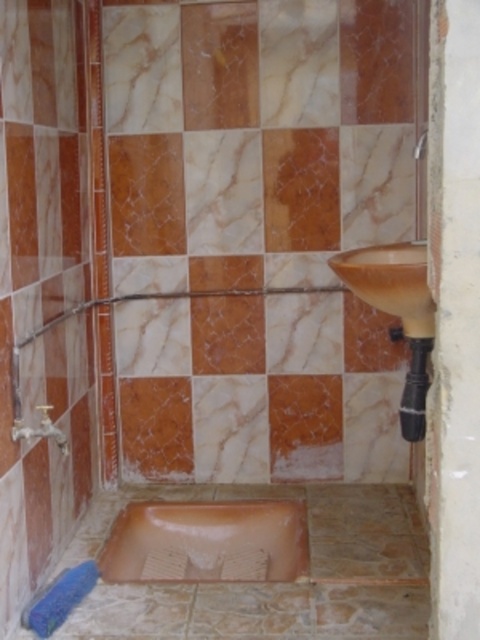
Question: Which object appears closest to the camera in this image?

Choices:
 (A) matte orange sink at center
 (B) matte brown bathtub at lower center

Answer: (A)

Question: Is matte brown bathtub at lower center closer to the viewer compared to matte orange sink at center?

Choices:
 (A) yes
 (B) no

Answer: (B)

Question: Which point is closer to the camera taking this photo?

Choices:
 (A) (360, 259)
 (B) (98, 564)

Answer: (A)

Question: Does matte brown bathtub at lower center come behind matte orange sink at center?

Choices:
 (A) no
 (B) yes

Answer: (B)

Question: Does matte brown bathtub at lower center appear under matte orange sink at center?

Choices:
 (A) no
 (B) yes

Answer: (B)

Question: Which of the following is the closest to the observer?

Choices:
 (A) matte brown bathtub at lower center
 (B) matte orange sink at center

Answer: (B)